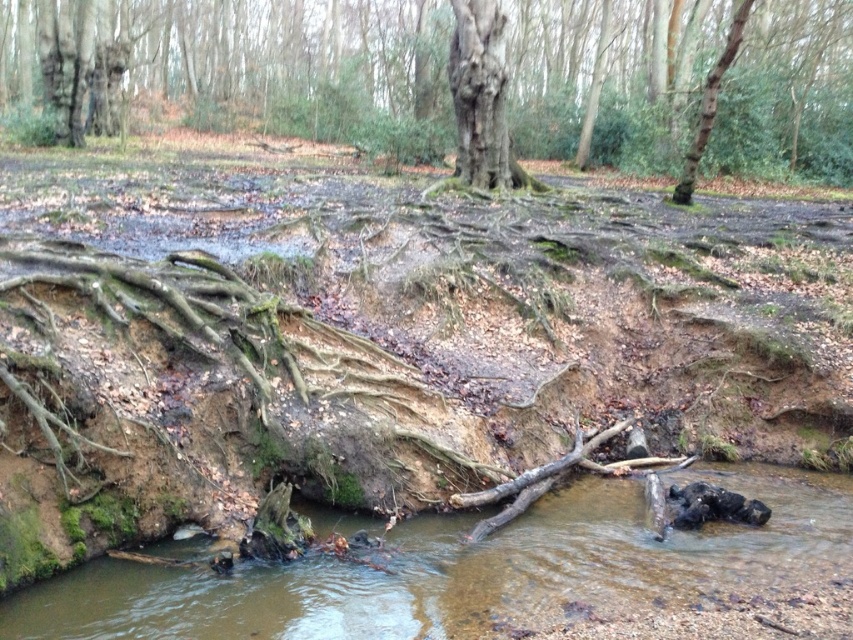
Question: Does rough bark tree at center have a smaller size compared to smooth bark tree trunk at center?

Choices:
 (A) no
 (B) yes

Answer: (A)

Question: Considering the real-world distances, which object is farthest from the brown rough bark tree trunk at upper right?

Choices:
 (A) brown muddy stream at lower center
 (B) smooth bark tree trunk at center

Answer: (A)

Question: Among these objects, which one is farthest from the camera?

Choices:
 (A) smooth bark tree trunk at center
 (B) brown muddy stream at lower center
 (C) rough bark tree at center
 (D) brown rough bark tree trunk at upper right

Answer: (A)

Question: Does rough bark tree at center appear on the right side of smooth bark tree trunk at center?

Choices:
 (A) yes
 (B) no

Answer: (B)

Question: Which of the following is the closest to the observer?

Choices:
 (A) smooth bark tree trunk at center
 (B) rough bark tree at center
 (C) brown rough bark tree trunk at upper right
 (D) brown muddy stream at lower center

Answer: (D)

Question: Can you confirm if brown muddy stream at lower center is bigger than brown rough bark tree trunk at upper right?

Choices:
 (A) no
 (B) yes

Answer: (A)